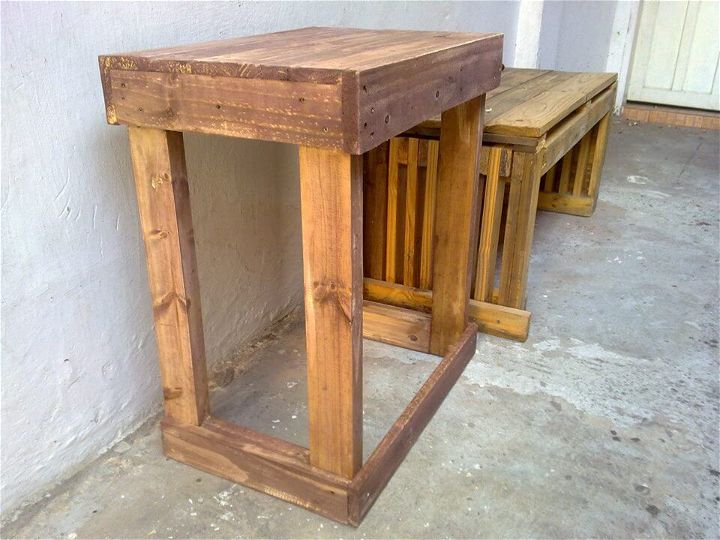
The width and height of the screenshot is (720, 540). Find the location of `white wall`. white wall is located at coordinates (81, 69).